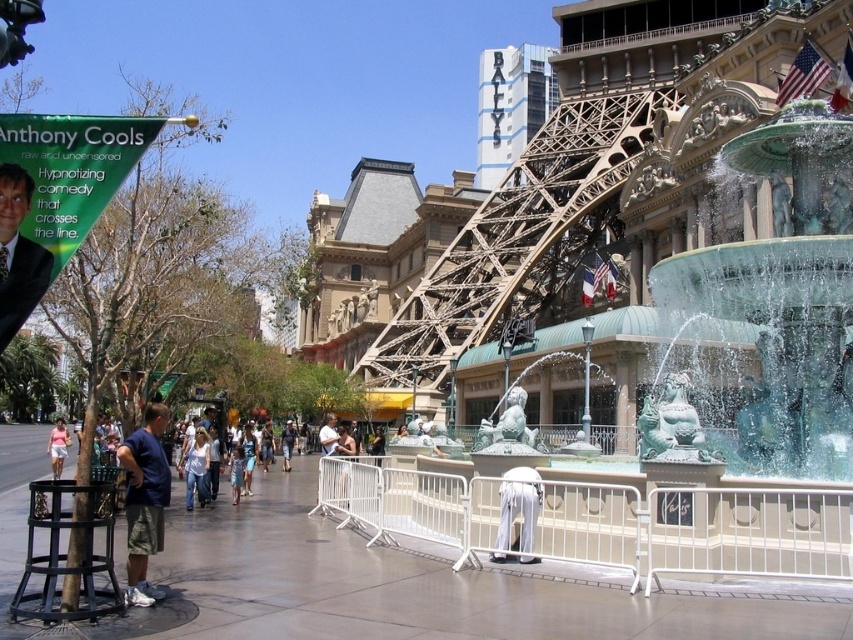
You are attending an event at the Paris Las Vegas hotel and see two guests dressed in the matte black suit at left and the light pink cotton shirt at center. Which guest is shorter?

The matte black suit at left is shorter than the light pink cotton shirt at center.

Based on the photo, you are a photographer standing at the Paris Las Vegas hotel. You notice the translucent glass fountain at center right and the light pink cotton shirt at center. Which object is higher in the scene?

The translucent glass fountain at center right is above the light pink cotton shirt at center, so it is higher in the scene.